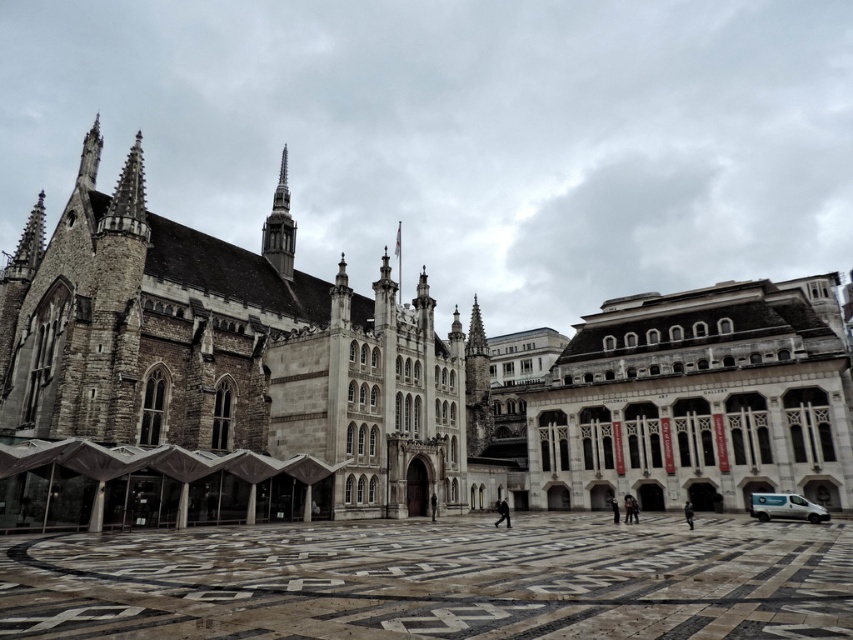
Question: In this image, where is marble floor at center located relative to silver spire at center?

Choices:
 (A) above
 (B) below

Answer: (B)

Question: Among these objects, which one is nearest to the camera?

Choices:
 (A) silver spire at center
 (B) white metallic van at lower right
 (C) stone church at center

Answer: (C)

Question: Which object is the farthest from the stone church at center?

Choices:
 (A) marble floor at center
 (B) white metallic van at lower right
 (C) silver spire at center
 (D) white stone building at center

Answer: (C)

Question: Which object appears closest to the camera in this image?

Choices:
 (A) silver spire at center
 (B) stone church at center
 (C) marble floor at center

Answer: (C)

Question: Is marble floor at center behind white stone building at center?

Choices:
 (A) yes
 (B) no

Answer: (B)

Question: Where is white stone building at center located in relation to silver spire at center in the image?

Choices:
 (A) left
 (B) right

Answer: (B)